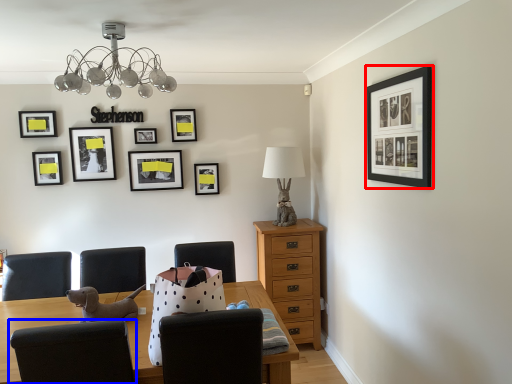
Question: Which object appears farthest to the camera in this image, picture frame (highlighted by a red box) or chair (highlighted by a blue box)?

Choices:
 (A) picture frame
 (B) chair

Answer: (A)